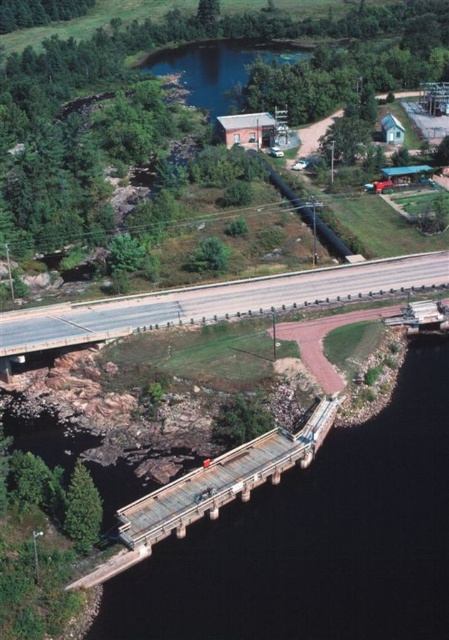
Question: Is asphalt road at center further to the viewer compared to rusty metal bridge at center?

Choices:
 (A) yes
 (B) no

Answer: (A)

Question: From the image, what is the correct spatial relationship of asphalt road at center in relation to rusty metal bridge at center?

Choices:
 (A) right
 (B) left

Answer: (B)

Question: Which object is closer to the camera taking this photo?

Choices:
 (A) rusty metal bridge at center
 (B) asphalt road at center

Answer: (A)

Question: Among these objects, which one is farthest from the camera?

Choices:
 (A) asphalt road at center
 (B) rusty metal bridge at center

Answer: (A)

Question: Does asphalt road at center come behind rusty metal bridge at center?

Choices:
 (A) no
 (B) yes

Answer: (B)